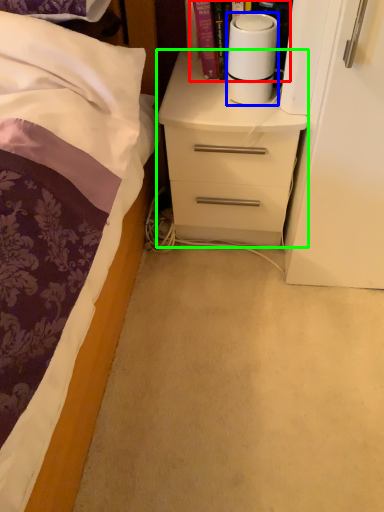
Question: Based on their relative distances, which object is farther from book (highlighted by a red box)? Choose from paper towel (highlighted by a blue box) and chest of drawers (highlighted by a green box).

Choices:
 (A) paper towel
 (B) chest of drawers

Answer: (B)